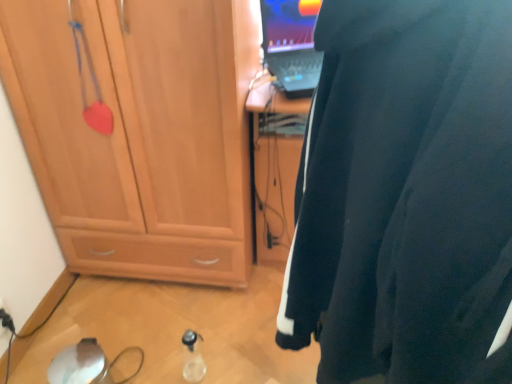
Question: Is transparent plastic bottle at lower center positioned beyond the bounds of black plastic electric outlet at lower left?

Choices:
 (A) yes
 (B) no

Answer: (A)

Question: Is transparent plastic bottle at lower center at the left side of black plastic electric outlet at lower left?

Choices:
 (A) yes
 (B) no

Answer: (B)

Question: From a real-world perspective, is transparent plastic bottle at lower center under black plastic electric outlet at lower left?

Choices:
 (A) yes
 (B) no

Answer: (A)

Question: Are transparent plastic bottle at lower center and black plastic electric outlet at lower left making contact?

Choices:
 (A) no
 (B) yes

Answer: (A)

Question: From a real-world perspective, is transparent plastic bottle at lower center over black plastic electric outlet at lower left?

Choices:
 (A) no
 (B) yes

Answer: (A)

Question: Is black plastic electric outlet at lower left at the back of transparent plastic bottle at lower center?

Choices:
 (A) yes
 (B) no

Answer: (A)

Question: Is the position of matte wood cabinet at left more distant than that of transparent plastic bottle at lower center?

Choices:
 (A) yes
 (B) no

Answer: (B)

Question: Does matte wood cabinet at left have a larger size compared to transparent plastic bottle at lower center?

Choices:
 (A) no
 (B) yes

Answer: (B)

Question: Is matte wood cabinet at left to the right of transparent plastic bottle at lower center from the viewer's perspective?

Choices:
 (A) yes
 (B) no

Answer: (B)

Question: Can you confirm if matte wood cabinet at left is taller than transparent plastic bottle at lower center?

Choices:
 (A) yes
 (B) no

Answer: (A)

Question: From the image's perspective, would you say matte wood cabinet at left is shown under transparent plastic bottle at lower center?

Choices:
 (A) no
 (B) yes

Answer: (A)

Question: Is matte wood cabinet at left not within transparent plastic bottle at lower center?

Choices:
 (A) no
 (B) yes

Answer: (B)

Question: Is matte wood cabinet at left wider than black fabric wetsuit at right?

Choices:
 (A) yes
 (B) no

Answer: (B)